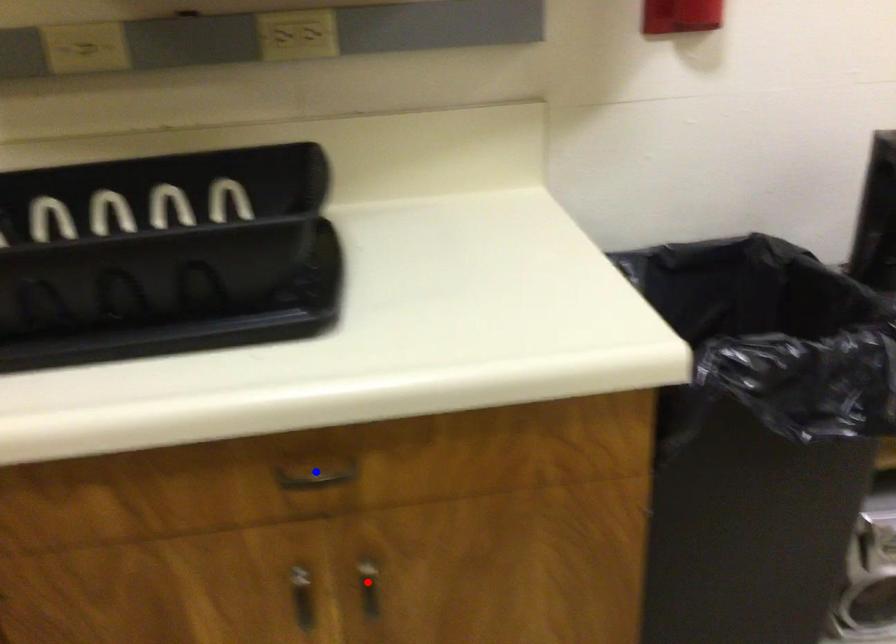
Question: Two points are marked on the image. Which point is closer to the camera?

Choices:
 (A) Blue point is closer.
 (B) Red point is closer.

Answer: (A)